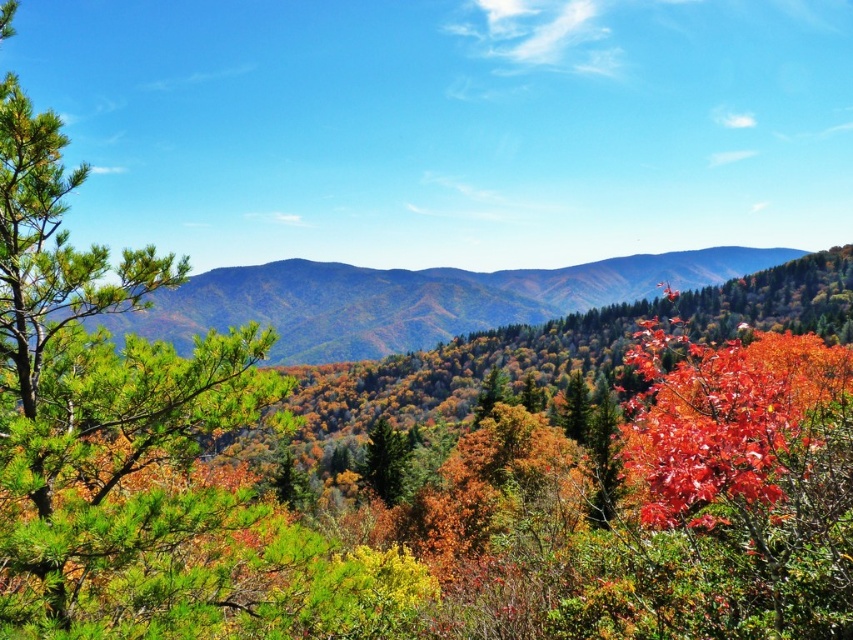
Question: Which point is farther to the camera?

Choices:
 (A) green matte tree at center
 (B) green matte forest at center

Answer: (A)

Question: Can you confirm if green matte forest at center is bigger than green matte tree at center?

Choices:
 (A) no
 (B) yes

Answer: (B)

Question: Can you confirm if green matte forest at center is positioned above green matte tree at center?

Choices:
 (A) no
 (B) yes

Answer: (B)

Question: Can you confirm if green matte forest at center is bigger than green matte tree at center?

Choices:
 (A) no
 (B) yes

Answer: (B)